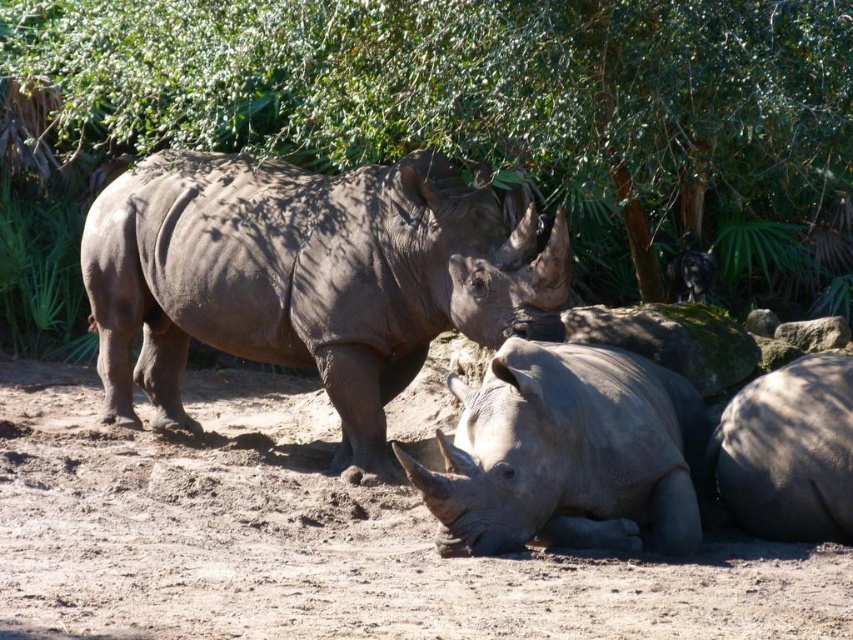
Does green leafy tree at upper center have a lesser height compared to dull brown dirt at center?

No, green leafy tree at upper center is not shorter than dull brown dirt at center.

Between green leafy tree at upper center and dull brown dirt at center, which one is positioned higher?

green leafy tree at upper center is above.

Between point (759, 125) and point (306, 554), which one is positioned behind?

Point (759, 125)

What are the coordinates of `green leafy tree at upper center` in the screenshot? It's located at (479, 92).

Is dull brown dirt at center thinner than gray matte rhinoceros at lower center?

Correct, dull brown dirt at center's width is less than gray matte rhinoceros at lower center's.

Is dull brown dirt at center to the right of gray matte rhinoceros at lower center from the viewer's perspective?

Incorrect, dull brown dirt at center is not on the right side of gray matte rhinoceros at lower center.

Locate an element on the screen. dull brown dirt at center is located at coordinates pyautogui.click(x=318, y=540).

Between green leafy tree at upper center and gray matte rhinoceros at center, which one appears on the right side from the viewer's perspective?

green leafy tree at upper center

Where is `green leafy tree at upper center`? green leafy tree at upper center is located at coordinates (479, 92).